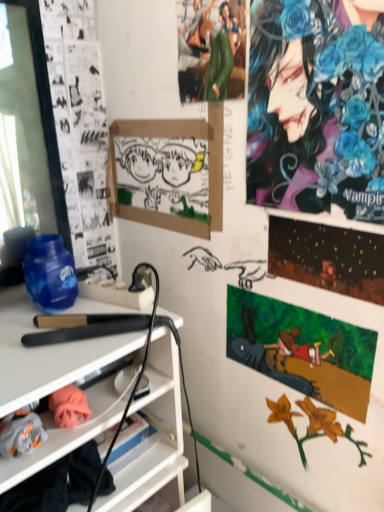
Question: Is watercolor paper painting at upper right, which appears as the first poster page when ordered from the bottom, at the right side of green fabric figure at upper center, marked as the 2th person in a right-to-left arrangement?

Choices:
 (A) yes
 (B) no

Answer: (A)

Question: Can you confirm if watercolor paper painting at upper right, arranged as the second poster page when viewed from the top, is smaller than green fabric figure at upper center, marked as the 2th person in a right-to-left arrangement?

Choices:
 (A) no
 (B) yes

Answer: (B)

Question: Can you confirm if watercolor paper painting at upper right, arranged as the second poster page when viewed from the top, is thinner than green fabric figure at upper center, marked as the 2th person in a right-to-left arrangement?

Choices:
 (A) no
 (B) yes

Answer: (B)

Question: Is watercolor paper painting at upper right, which appears as the first poster page when ordered from the bottom, looking in the opposite direction of green fabric figure at upper center, the 1th person when ordered from left to right?

Choices:
 (A) no
 (B) yes

Answer: (A)

Question: From the image's perspective, does watercolor paper painting at upper right, which appears as the first poster page when ordered from the bottom, appear higher than green fabric figure at upper center, the 1th person when ordered from left to right?

Choices:
 (A) yes
 (B) no

Answer: (B)

Question: Is watercolor paper painting at upper right, which appears as the first poster page when ordered from the bottom, positioned far away from green fabric figure at upper center, marked as the 2th person in a right-to-left arrangement?

Choices:
 (A) yes
 (B) no

Answer: (B)

Question: Is black matte hair straightener at center left completely or partially outside of shiny metallic poster at upper right, which is the 2th poster page in bottom-to-top order?

Choices:
 (A) yes
 (B) no

Answer: (A)

Question: Is shiny metallic poster at upper right, which is the 2th poster page in bottom-to-top order, completely or partially inside black matte hair straightener at center left?

Choices:
 (A) no
 (B) yes

Answer: (A)

Question: Is black matte hair straightener at center left far away from shiny metallic poster at upper right, which is the 2th poster page in bottom-to-top order?

Choices:
 (A) no
 (B) yes

Answer: (A)

Question: Does black matte hair straightener at center left have a smaller size compared to shiny metallic poster at upper right, the 1th poster page positioned from the top?

Choices:
 (A) yes
 (B) no

Answer: (B)

Question: Does black matte hair straightener at center left touch shiny metallic poster at upper right, which is the 2th poster page in bottom-to-top order?

Choices:
 (A) no
 (B) yes

Answer: (A)

Question: Is black matte hair straightener at center left further to the viewer compared to shiny metallic poster at upper right, the 1th poster page positioned from the top?

Choices:
 (A) yes
 (B) no

Answer: (A)

Question: Is shiny metallic poster at upper right, which is the 2th poster page in bottom-to-top order, at the left side of watercolor paper painting at upper right, arranged as the second poster page when viewed from the top?

Choices:
 (A) yes
 (B) no

Answer: (B)